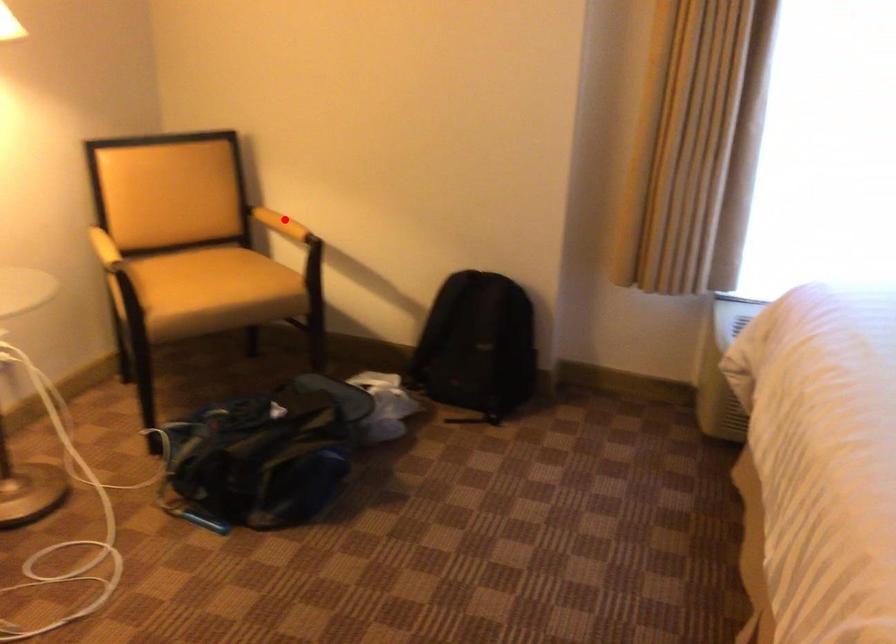
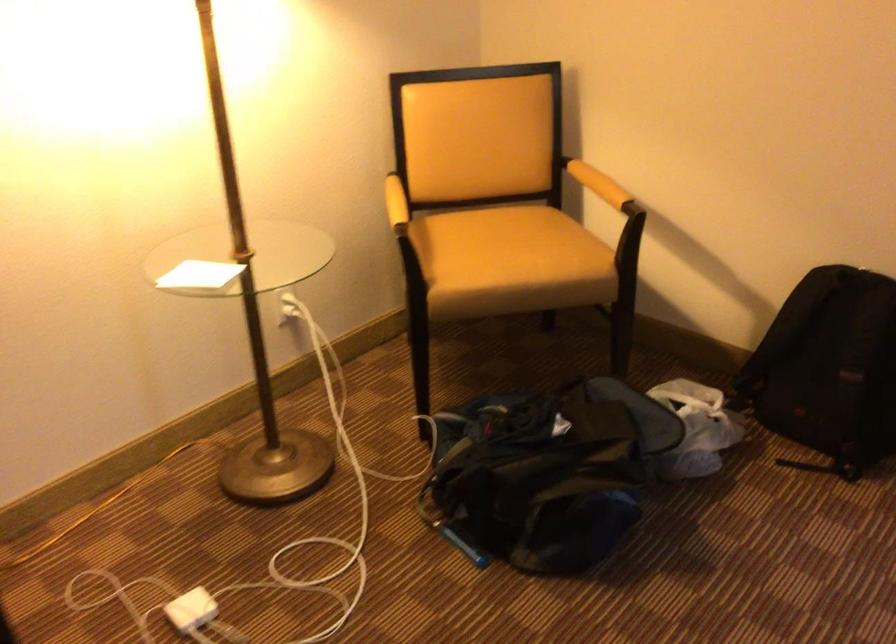
Question: I am providing you with two images of the same scene from different viewpoints. Given a red point in image1, look at the same physical point in image2. Is it:

Choices:
 (A) Closer to the viewpoint
 (B) Farther from the viewpoint

Answer: (A)